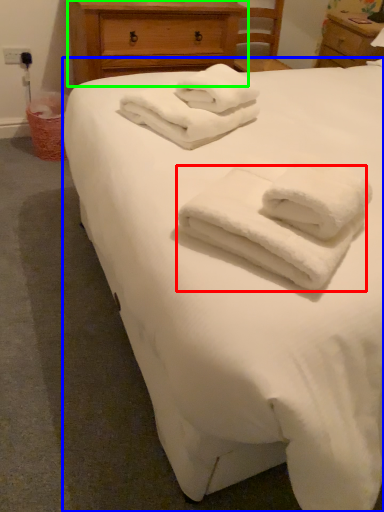
Question: Estimate the real-world distances between objects in this image. Which object is farther from towel (highlighted by a red box), bed (highlighted by a blue box) or chest of drawers (highlighted by a green box)?

Choices:
 (A) bed
 (B) chest of drawers

Answer: (B)